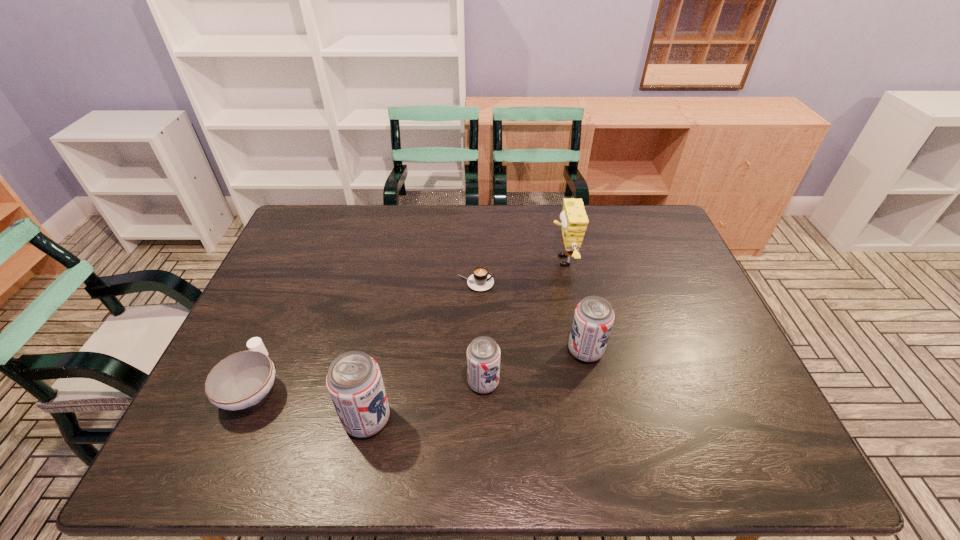
I want to click on free region located 0.080m on the left of the fifth object from right to left, so click(x=308, y=418).

The width and height of the screenshot is (960, 540). Identify the location of free region located 0.400m on the right of the shortest beer can. (662, 382).

Where is `free location located 0.370m on the back of the third tallest object`? This screenshot has width=960, height=540. free location located 0.370m on the back of the third tallest object is located at coordinates (564, 249).

Locate an element on the screen. The image size is (960, 540). free space located on the front-facing side of the sponge is located at coordinates (461, 260).

Locate an element on the screen. The height and width of the screenshot is (540, 960). free point located 0.110m on the front-facing side of the sponge is located at coordinates pyautogui.click(x=514, y=260).

Image resolution: width=960 pixels, height=540 pixels. I want to click on vacant space located 0.260m on the front-facing side of the sponge, so click(468, 260).

Locate an element on the screen. The width and height of the screenshot is (960, 540). free space located 0.150m with the handle on the side of the shortest object is located at coordinates (543, 283).

Find the location of a particular element. This screenshot has height=540, width=960. free spot located on the side with the handle of the second shortest object is located at coordinates (300, 282).

Find the location of a particular element. The image size is (960, 540). vacant space located 0.350m on the side with the handle of the second shortest object is located at coordinates (306, 266).

You are a GUI agent. You are given a task and a screenshot of the screen. Output one action in this format:
    pyautogui.click(x=<x>, y=<y>)
    Task: Click on the vacant space located 0.050m on the side with the handle of the second shortest object
    The image size is (960, 540).
    Given the screenshot: What is the action you would take?
    pyautogui.click(x=274, y=341)